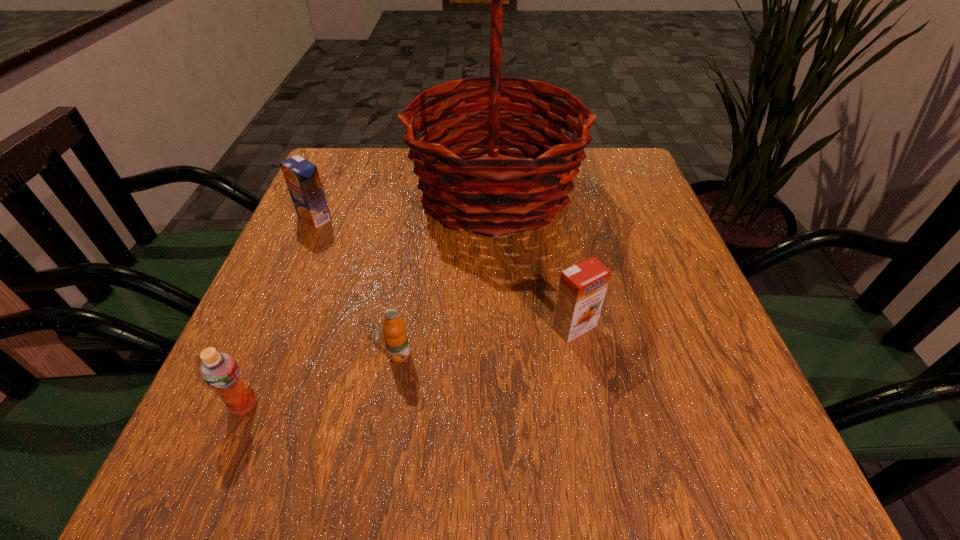
The image size is (960, 540). Identify the location of free space located on the back of the nearest orange juice. (310, 245).

What are the coordinates of `vacant region located 0.100m on the label of the shortest orange juice` in the screenshot? It's located at (389, 421).

Identify the location of object that is at the far edge. (465, 188).

In the image, there is a desktop. At what (x,y) coordinates should I click in order to perform the action: click on vacant region at the near edge. Please return your answer as a coordinate pair (x, y). The width and height of the screenshot is (960, 540). Looking at the image, I should click on (663, 473).

Identify the location of vacant area at the left edge of the desktop. This screenshot has height=540, width=960. (256, 426).

Identify the location of vacant space at the right edge of the desktop. (706, 307).

In the image, there is a desktop. At what (x,y) coordinates should I click in order to perform the action: click on vacant area at the far left corner. Please return your answer as a coordinate pair (x, y). The image size is (960, 540). Looking at the image, I should click on (333, 171).

This screenshot has width=960, height=540. I want to click on vacant region at the near left corner, so click(270, 473).

You are a GUI agent. You are given a task and a screenshot of the screen. Output one action in this format:
    pyautogui.click(x=<x>, y=<y>)
    Task: Click on the free space at the far right corner
    
    Given the screenshot: What is the action you would take?
    pyautogui.click(x=628, y=181)

Locate an element on the screen. The image size is (960, 540). free space between the third nearest object and the farthest orange juice is located at coordinates (444, 272).